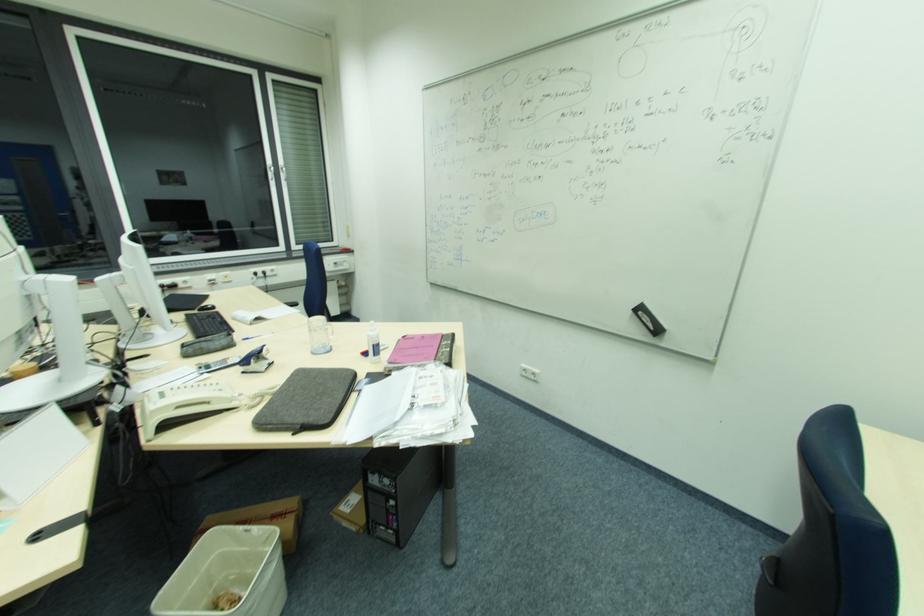
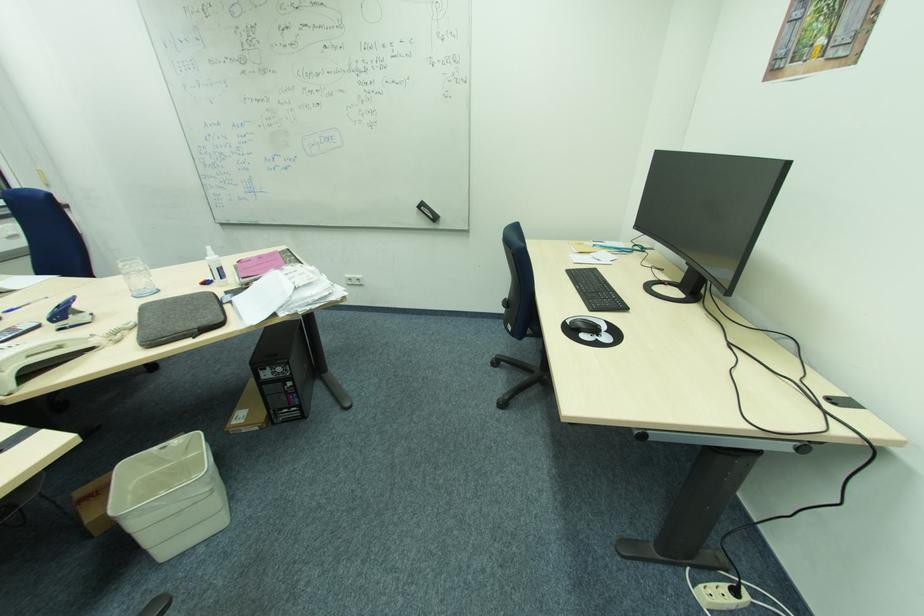
The point at (263,548) is marked in the first image. Where is the corresponding point in the second image?

(187, 459)